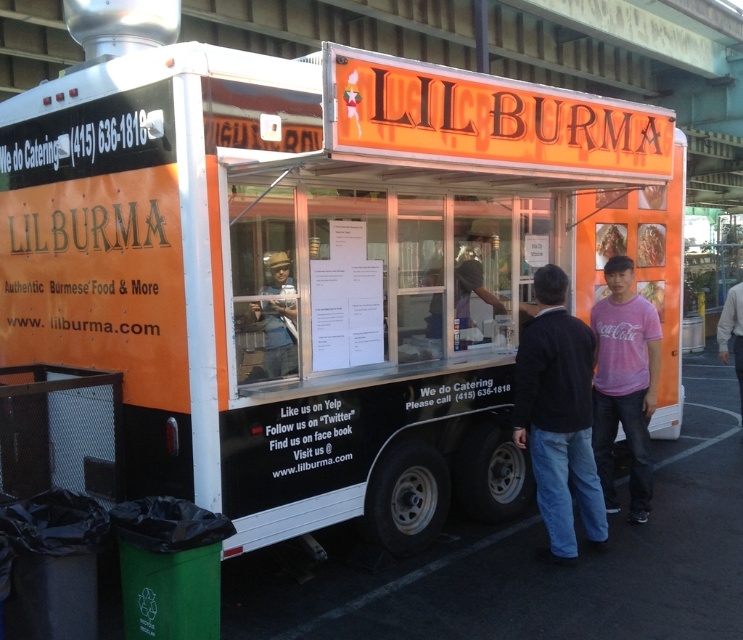
Who is lower down, pink cotton t-shirt at center or pink cotton t-shirt at center-right?

pink cotton t-shirt at center is below.

Is pink cotton t-shirt at center below pink cotton t-shirt at center-right?

Correct, pink cotton t-shirt at center is located below pink cotton t-shirt at center-right.

Image resolution: width=743 pixels, height=640 pixels. What are the coordinates of `pink cotton t-shirt at center` in the screenshot? It's located at (558, 417).

Locate an element on the screen. Image resolution: width=743 pixels, height=640 pixels. pink cotton t-shirt at center is located at coordinates (558, 417).

Which is behind, point (655, 380) or point (739, 403)?

Positioned behind is point (739, 403).

In order to click on pink cotton t-shirt at center-right in this screenshot , I will do tap(623, 384).

Image resolution: width=743 pixels, height=640 pixels. Find the location of `pink cotton t-shirt at center-right`. pink cotton t-shirt at center-right is located at coordinates (623, 384).

Can you confirm if pink cotton t-shirt at center is positioned to the right of pink cotton shirt at right?

No, pink cotton t-shirt at center is not to the right of pink cotton shirt at right.

Can you confirm if pink cotton t-shirt at center is positioned above pink cotton shirt at right?

Actually, pink cotton t-shirt at center is below pink cotton shirt at right.

I want to click on pink cotton t-shirt at center, so click(x=558, y=417).